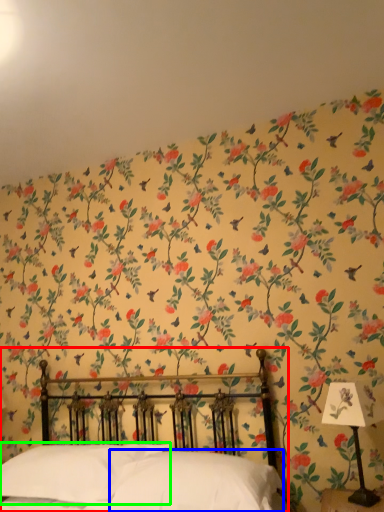
Question: Which is farther away from bed (highlighted by a red box)? pillow (highlighted by a blue box) or pillow (highlighted by a green box)?

Choices:
 (A) pillow
 (B) pillow

Answer: (A)